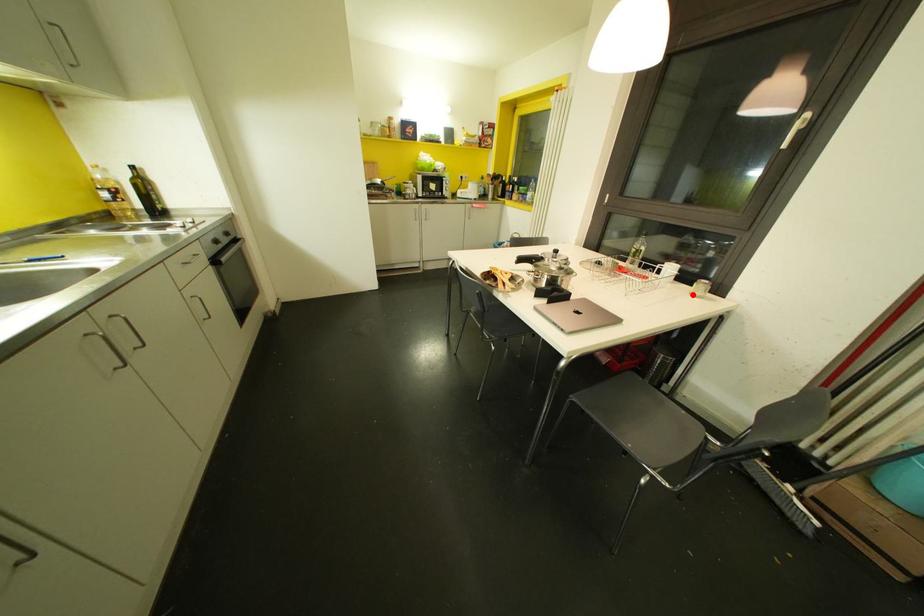
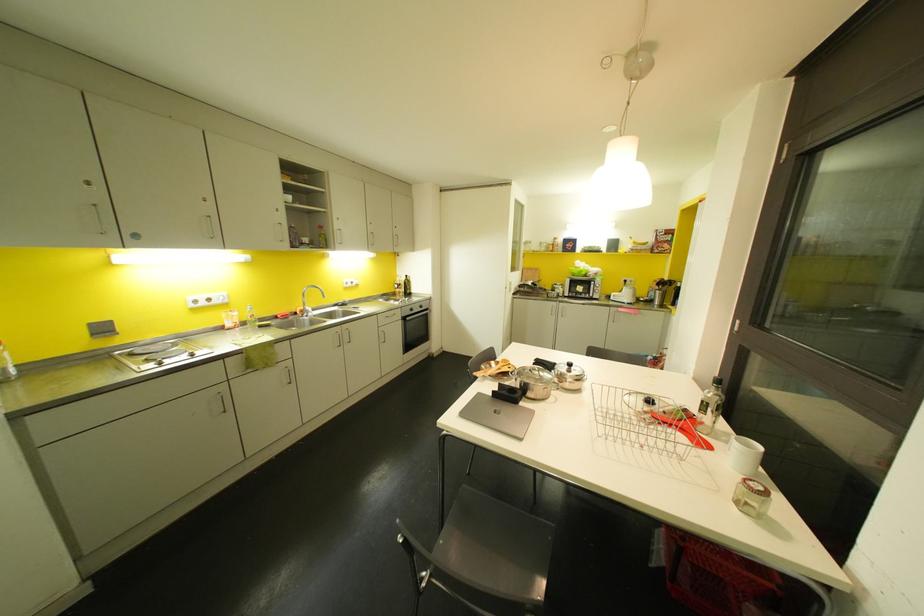
In the second image, find the point that corresponds to the highlighted location in the first image.

(736, 501)